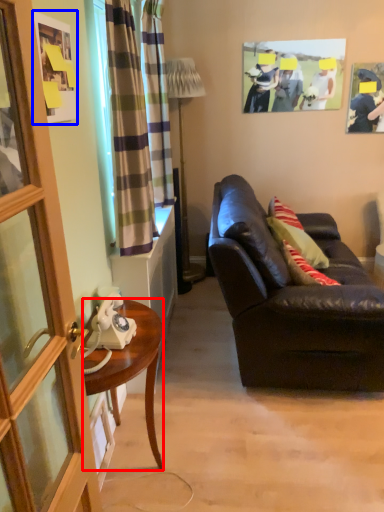
Question: Which of the following is the closest to the observer, desk (highlighted by a red box) or picture frame (highlighted by a blue box)?

Choices:
 (A) desk
 (B) picture frame

Answer: (B)